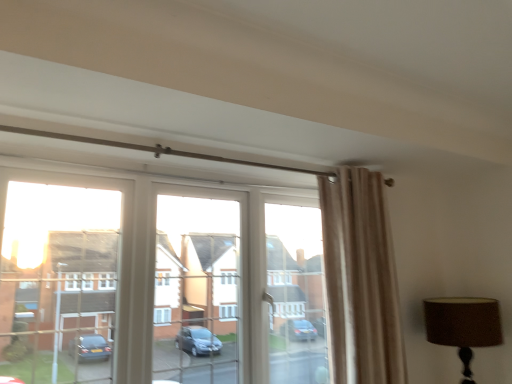
Identify the location of beige velvet curtain at upper right. This screenshot has width=512, height=384. (360, 280).

The image size is (512, 384). Find the location of `beige velvet curtain at upper right`. beige velvet curtain at upper right is located at coordinates (360, 280).

Is transparent glass window at center outside of brown fabric lampshade at upper right?

transparent glass window at center lies outside brown fabric lampshade at upper right's area.

In the scene shown: Between transparent glass window at center and brown fabric lampshade at upper right, which one is positioned behind?

brown fabric lampshade at upper right.

Which of these two, transparent glass window at center or brown fabric lampshade at upper right, stands taller?

With more height is transparent glass window at center.

Could you tell me if transparent glass window at center is facing brown fabric lampshade at upper right?

No, transparent glass window at center is not aimed at brown fabric lampshade at upper right.

Does beige velvet curtain at upper right appear on the left side of transparent glass window at center?

Incorrect, beige velvet curtain at upper right is not on the left side of transparent glass window at center.

Considering the relative sizes of beige velvet curtain at upper right and transparent glass window at center in the image provided, is beige velvet curtain at upper right smaller than transparent glass window at center?

Indeed, beige velvet curtain at upper right has a smaller size compared to transparent glass window at center.

Between point (348, 301) and point (305, 319), which one is positioned behind?

Point (305, 319)

Between beige velvet curtain at upper right and brown fabric lampshade at upper right, which one is positioned behind?

brown fabric lampshade at upper right is further away from the camera.

Would you say beige velvet curtain at upper right is inside or outside brown fabric lampshade at upper right?

The correct answer is: outside.

In terms of height, does brown fabric lampshade at upper right look taller or shorter compared to transparent glass window at center?

Clearly, brown fabric lampshade at upper right is shorter compared to transparent glass window at center.

Looking at their sizes, would you say brown fabric lampshade at upper right is wider or thinner than transparent glass window at center?

brown fabric lampshade at upper right is wider than transparent glass window at center.

From the image's perspective, between brown fabric lampshade at upper right and transparent glass window at center, which one is located above?

transparent glass window at center.

Is brown fabric lampshade at upper right in front of or behind transparent glass window at center in the image?

Visually, brown fabric lampshade at upper right is located behind transparent glass window at center.

Does brown fabric lampshade at upper right turn towards beige velvet curtain at upper right?

Yes, brown fabric lampshade at upper right faces towards beige velvet curtain at upper right.

The image size is (512, 384). Find the location of `table lamp located below the beige velvet curtain at upper right (from the image's perspective)`. table lamp located below the beige velvet curtain at upper right (from the image's perspective) is located at coordinates (463, 326).

Between brown fabric lampshade at upper right and beige velvet curtain at upper right, which one appears on the left side from the viewer's perspective?

beige velvet curtain at upper right.

Visually, is transparent glass window at center positioned to the left or to the right of beige velvet curtain at upper right?

Clearly, transparent glass window at center is on the left of beige velvet curtain at upper right in the image.

From the image's perspective, is transparent glass window at center on beige velvet curtain at upper right?

Incorrect, from the image's perspective, transparent glass window at center is lower than beige velvet curtain at upper right.

How much distance is there between transparent glass window at center and beige velvet curtain at upper right?

transparent glass window at center is 21.55 inches from beige velvet curtain at upper right.

Who is shorter, transparent glass window at center or beige velvet curtain at upper right?

With less height is transparent glass window at center.

Locate an element on the screen. table lamp below the transparent glass window at center (from the image's perspective) is located at coordinates (463, 326).

I want to click on window that appears on the left of beige velvet curtain at upper right, so click(x=186, y=282).

From the image, which object appears to be farther from beige velvet curtain at upper right, transparent glass window at center or brown fabric lampshade at upper right?

transparent glass window at center.

Estimate the real-world distances between objects in this image. Which object is further from transparent glass window at center, brown fabric lampshade at upper right or beige velvet curtain at upper right?

Among the two, brown fabric lampshade at upper right is located further to transparent glass window at center.

Considering their positions, is beige velvet curtain at upper right positioned closer to transparent glass window at center than brown fabric lampshade at upper right?

→ beige velvet curtain at upper right is closer to transparent glass window at center.

Based on their spatial positions, is brown fabric lampshade at upper right or transparent glass window at center further from beige velvet curtain at upper right?

transparent glass window at center.

From the picture: Considering their positions, is beige velvet curtain at upper right positioned further to brown fabric lampshade at upper right than transparent glass window at center?

Among the two, transparent glass window at center is located further to brown fabric lampshade at upper right.

From the image, which object appears to be farther from brown fabric lampshade at upper right, transparent glass window at center or beige velvet curtain at upper right?

Among the two, transparent glass window at center is located further to brown fabric lampshade at upper right.

This screenshot has height=384, width=512. In order to click on curtain between transparent glass window at center and brown fabric lampshade at upper right in the horizontal direction in this screenshot , I will do `click(360, 280)`.